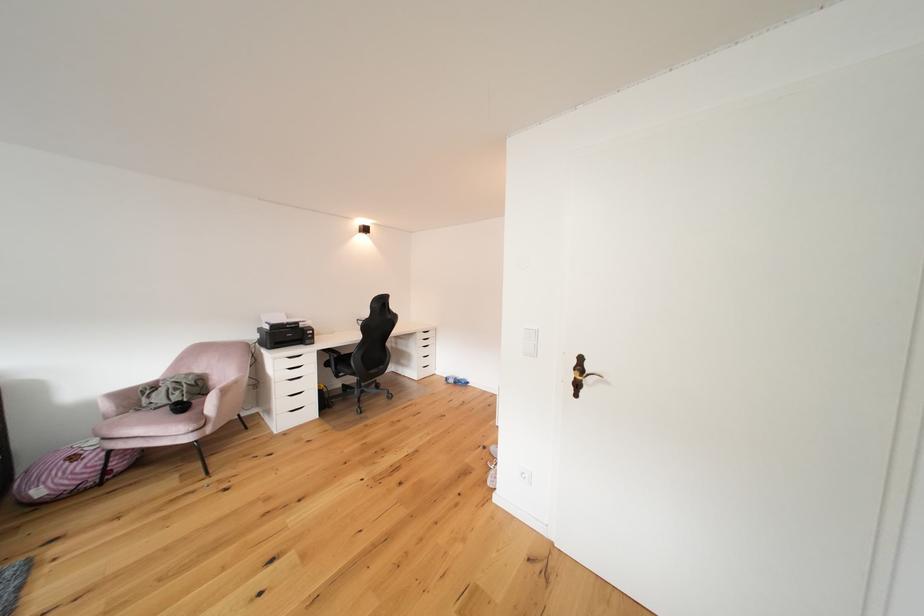
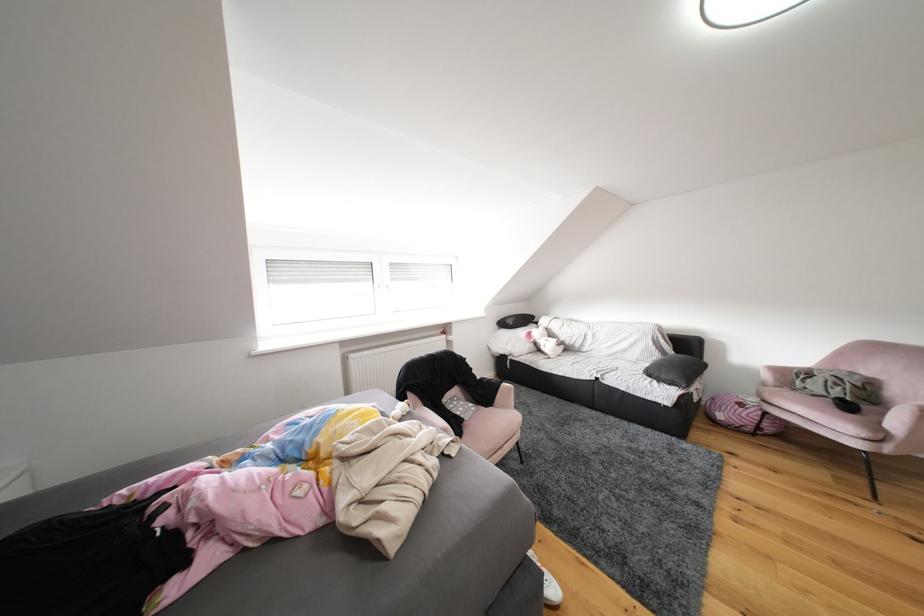
Question: The first image is from the beginning of the video and the second image is from the end. How did the camera likely rotate when shooting the video?

Choices:
 (A) Left
 (B) Right
 (C) Up
 (D) Down

Answer: (A)